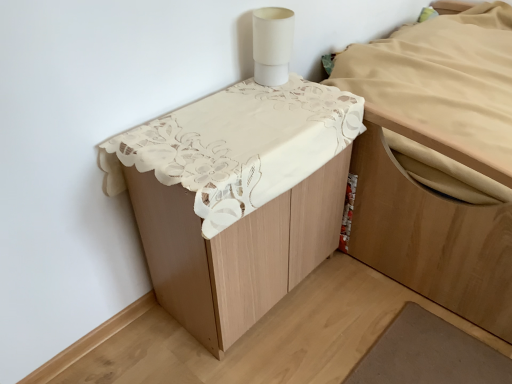
Question: Considering the relative positions of white lace tablecloth at upper center, acting as the second furniture starting from the right, and light brown wood bed at upper right, the first furniture when ordered from right to left, in the image provided, is white lace tablecloth at upper center, acting as the second furniture starting from the right, to the left or to the right of light brown wood bed at upper right, the first furniture when ordered from right to left,?

Choices:
 (A) left
 (B) right

Answer: (A)

Question: Is white lace tablecloth at upper center, the 1th furniture from the left, inside the boundaries of light brown wood bed at upper right, the second furniture from the left, or outside?

Choices:
 (A) inside
 (B) outside

Answer: (B)

Question: Considering the real-world distances, which object is closest to the white matte cylindrical lamp at upper right?

Choices:
 (A) white lace tablecloth at upper center, the 1th furniture from the left
 (B) light brown wood bed at upper right, the first furniture when ordered from right to left

Answer: (A)

Question: Which of these objects is positioned farthest from the light brown wood bed at upper right, the first furniture when ordered from right to left?

Choices:
 (A) white matte cylindrical lamp at upper right
 (B) white lace tablecloth at upper center, the 1th furniture from the left

Answer: (A)